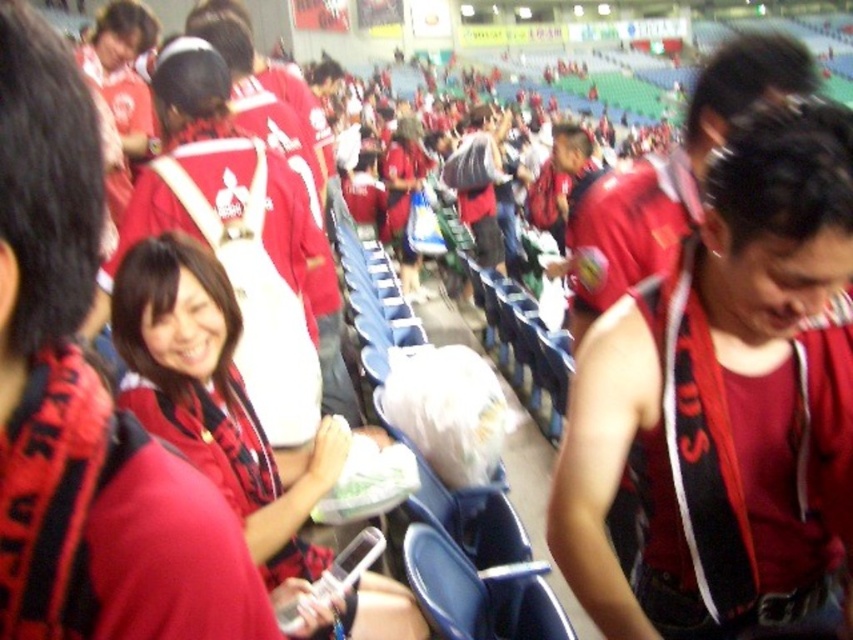
Question: Which object is closer to the camera taking this photo?

Choices:
 (A) matte red jacket at center
 (B) matte red shirt at center
 (C) matte red jersey at center

Answer: (B)

Question: Can you confirm if matte red jacket at center is bigger than matte red jersey at center?

Choices:
 (A) no
 (B) yes

Answer: (A)

Question: Can you confirm if matte red shirt at center is positioned above matte red jacket at center?

Choices:
 (A) yes
 (B) no

Answer: (A)

Question: Which point appears farthest from the camera in this image?

Choices:
 (A) (663, 209)
 (B) (614, 349)
 (C) (260, 496)

Answer: (A)

Question: Which of these objects is positioned farthest from the matte red jersey at center?

Choices:
 (A) matte red shirt at center
 (B) matte red jacket at center

Answer: (B)

Question: Is matte red jacket at center below matte red jersey at center?

Choices:
 (A) yes
 (B) no

Answer: (A)